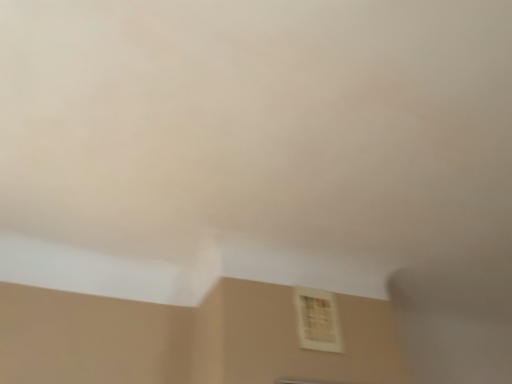
Find the location of a particular element. The image size is (512, 384). white plastic vent at lower center is located at coordinates (318, 320).

What do you see at coordinates (318, 320) in the screenshot? The width and height of the screenshot is (512, 384). I see `white plastic vent at lower center` at bounding box center [318, 320].

At what (x,y) coordinates should I click in order to perform the action: click on white plastic vent at lower center. Please return your answer as a coordinate pair (x, y). Looking at the image, I should click on (318, 320).